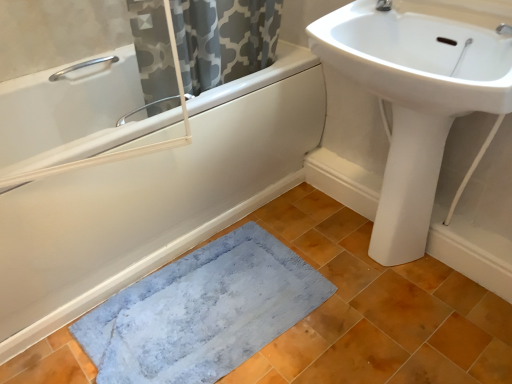
Question: Can you confirm if blue soft rug at lower left is positioned to the left of white matte bathtub at lower left?

Choices:
 (A) yes
 (B) no

Answer: (B)

Question: Is blue soft rug at lower left oriented towards white matte bathtub at lower left?

Choices:
 (A) yes
 (B) no

Answer: (B)

Question: Does blue soft rug at lower left appear on the right side of white matte bathtub at lower left?

Choices:
 (A) yes
 (B) no

Answer: (A)

Question: Is blue soft rug at lower left facing away from white matte bathtub at lower left?

Choices:
 (A) yes
 (B) no

Answer: (B)

Question: Are blue soft rug at lower left and white matte bathtub at lower left far apart?

Choices:
 (A) no
 (B) yes

Answer: (A)

Question: From a real-world perspective, is blue soft rug at lower left positioned under white matte bathtub at lower left based on gravity?

Choices:
 (A) no
 (B) yes

Answer: (B)

Question: Is white matte bathtub at lower left surrounded by white glossy bidet at lower right?

Choices:
 (A) no
 (B) yes

Answer: (A)

Question: Is white glossy bidet at lower right facing away from white matte bathtub at lower left?

Choices:
 (A) no
 (B) yes

Answer: (A)

Question: Are white glossy bidet at lower right and white matte bathtub at lower left located far from each other?

Choices:
 (A) yes
 (B) no

Answer: (B)

Question: Does white glossy bidet at lower right have a greater height compared to white matte bathtub at lower left?

Choices:
 (A) yes
 (B) no

Answer: (A)

Question: Could you tell me if white glossy bidet at lower right is turned towards white matte bathtub at lower left?

Choices:
 (A) no
 (B) yes

Answer: (A)

Question: Is white glossy bidet at lower right at the right side of white matte bathtub at lower left?

Choices:
 (A) yes
 (B) no

Answer: (A)

Question: From a real-world perspective, is silver metallic grab bar at upper left on top of white matte bathtub at lower left?

Choices:
 (A) yes
 (B) no

Answer: (A)